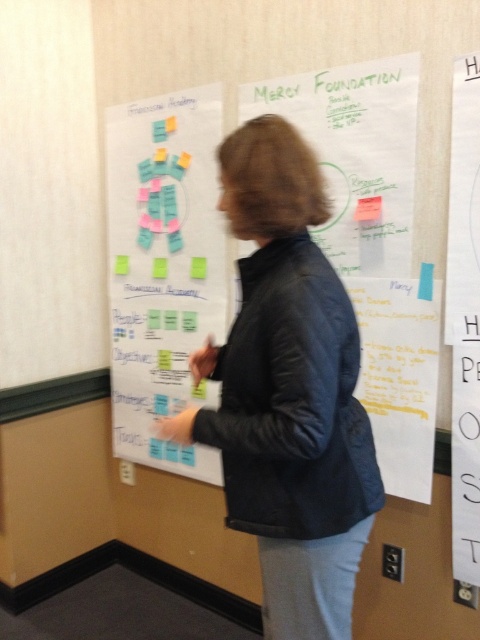
Does dark blue leather jacket at center appear on the right side of white paper at upper right?

Incorrect, dark blue leather jacket at center is not on the right side of white paper at upper right.

Does dark blue leather jacket at center lie behind white paper at upper right?

No.

Which is in front, point (286, 573) or point (468, 96)?

Point (286, 573)

Identify the location of dark blue leather jacket at center. Image resolution: width=480 pixels, height=640 pixels. (288, 392).

Between teal matte sticky notes at center and white paper at upper right, which one is positioned higher?

teal matte sticky notes at center

Which of these two, teal matte sticky notes at center or white paper at upper right, stands taller?

Standing taller between the two is white paper at upper right.

The width and height of the screenshot is (480, 640). In order to click on teal matte sticky notes at center in this screenshot , I will do `click(163, 268)`.

The image size is (480, 640). Identify the location of teal matte sticky notes at center. click(163, 268).

Does dark blue leather jacket at center have a smaller size compared to teal matte sticky notes at center?

Correct, dark blue leather jacket at center occupies less space than teal matte sticky notes at center.

Is point (276, 436) farther from camera compared to point (143, 310)?

No, (276, 436) is closer to viewer.

Locate an element on the screen. dark blue leather jacket at center is located at coordinates (288, 392).